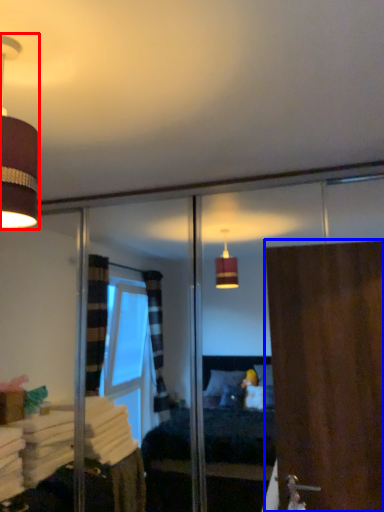
Question: Which object appears farthest to the camera in this image, lamp (highlighted by a red box) or door (highlighted by a blue box)?

Choices:
 (A) lamp
 (B) door

Answer: (B)